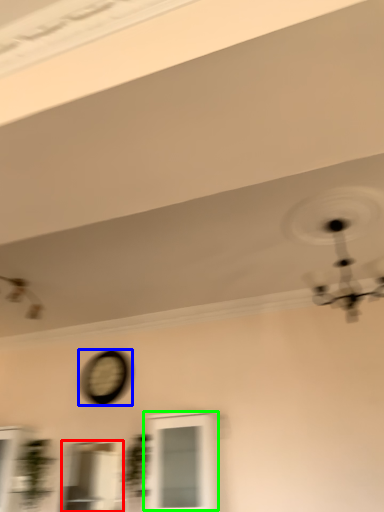
Question: Which object is the farthest from window (highlighted by a red box)? Choose among these: clock (highlighted by a blue box) or window (highlighted by a green box).

Choices:
 (A) clock
 (B) window

Answer: (B)